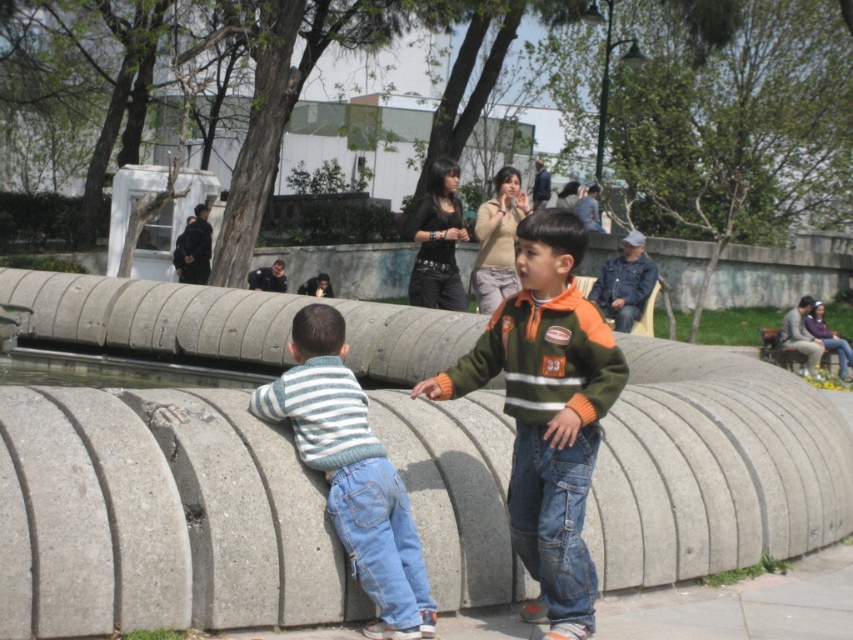
Does gray concrete at center come behind orange-green fleece jacket at center?

Yes, it is.

Is gray concrete at center taller than orange-green fleece jacket at center?

In fact, gray concrete at center may be shorter than orange-green fleece jacket at center.

What do you see at coordinates (158, 516) in the screenshot?
I see `gray concrete at center` at bounding box center [158, 516].

Locate an element on the screen. gray concrete at center is located at coordinates (158, 516).

Which is in front, point (529, 307) or point (415, 584)?

Positioned in front is point (529, 307).

Between orange-green fleece jacket at center and striped knit sweater at left, which one has more height?

orange-green fleece jacket at center

Is point (482, 356) farther from viewer compared to point (405, 520)?

Yes, it is.

You are a GUI agent. You are given a task and a screenshot of the screen. Output one action in this format:
    pyautogui.click(x=<x>, y=<y>)
    Task: Click on the orange-green fleece jacket at center
    
    Given the screenshot: What is the action you would take?
    pyautogui.click(x=547, y=412)

Locate an element on the screen. gray concrete at center is located at coordinates (158, 516).

Between gray concrete at center and striped knit sweater at left, which one is positioned higher?

Positioned higher is striped knit sweater at left.

Find the location of `gray concrete at center`. gray concrete at center is located at coordinates (158, 516).

Locate an element on the screen. The width and height of the screenshot is (853, 640). gray concrete at center is located at coordinates (158, 516).